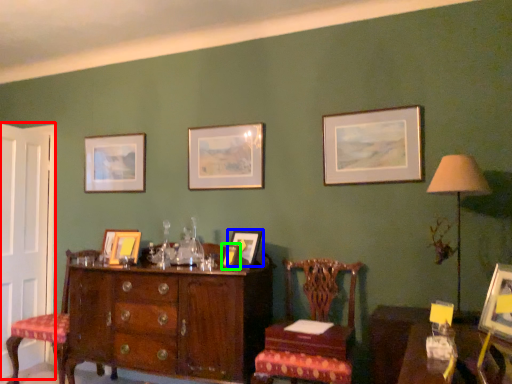
Question: Based on their relative distances, which object is nearer to door (highlighted by a red box)? Choose from picture frame (highlighted by a blue box) and picture frame (highlighted by a green box).

Choices:
 (A) picture frame
 (B) picture frame

Answer: (B)